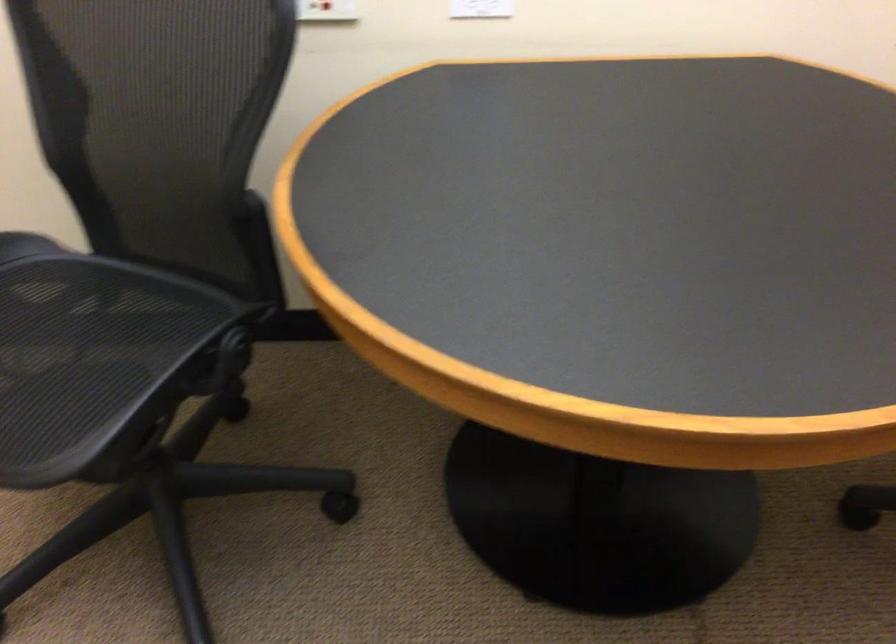
What do you see at coordinates (75, 373) in the screenshot? The width and height of the screenshot is (896, 644). I see `the chair sitting surface` at bounding box center [75, 373].